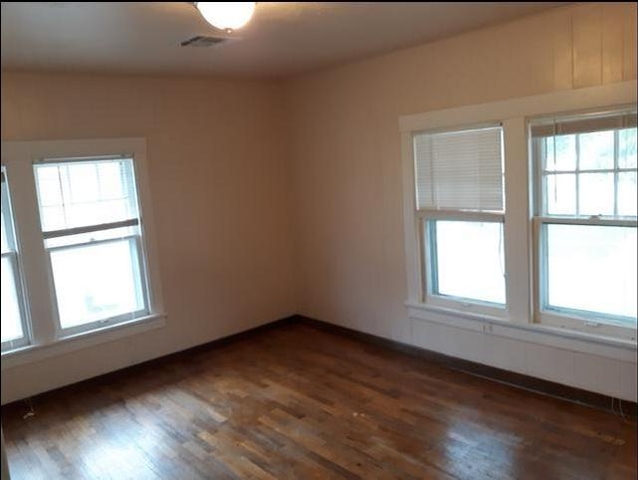
Identify the location of sun light coming in the window. The height and width of the screenshot is (480, 638). (590, 267), (448, 255), (101, 281), (6, 318), (87, 192), (573, 179).